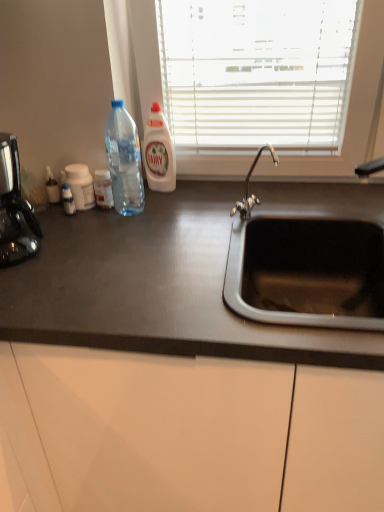
Locate an element on the screen. free location to the right of white plastic bottle at center is located at coordinates (208, 189).